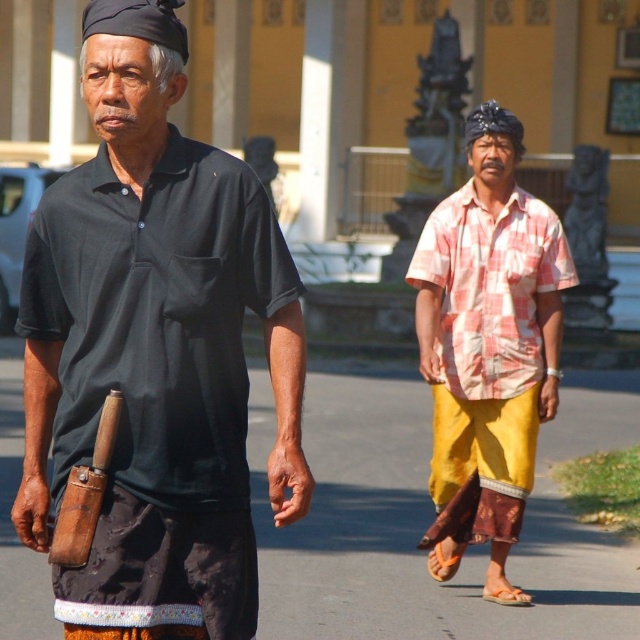
Question: Among these objects, which one is farthest from the camera?

Choices:
 (A) matte black shirt at center
 (B) pink checkered shirt at right
 (C) checkered fabric shirt at right

Answer: (B)

Question: Does matte black shirt at center appear over checkered fabric shirt at right?

Choices:
 (A) yes
 (B) no

Answer: (A)

Question: Can you confirm if matte black shirt at center is smaller than pink checkered shirt at right?

Choices:
 (A) no
 (B) yes

Answer: (A)

Question: Which of the following is the farthest from the observer?

Choices:
 (A) checkered fabric shirt at right
 (B) matte black shirt at center

Answer: (A)

Question: Which object is positioned closest to the pink checkered shirt at right?

Choices:
 (A) matte black shirt at center
 (B) checkered fabric shirt at right

Answer: (B)

Question: Does matte black shirt at center appear on the right side of pink checkered shirt at right?

Choices:
 (A) yes
 (B) no

Answer: (B)